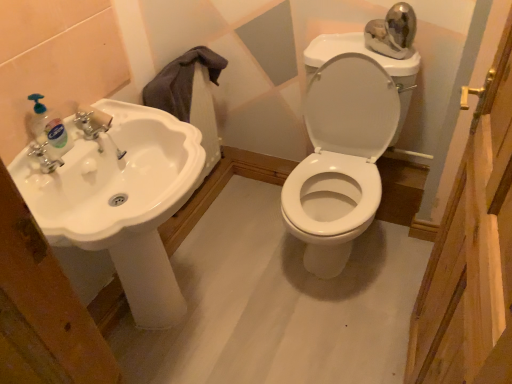
The image size is (512, 384). What are the coordinates of `white glossy sink at left` in the screenshot? It's located at (122, 201).

Describe the element at coordinates (340, 159) in the screenshot. I see `white glossy toilet at center` at that location.

Locate an element on the screen. Image resolution: width=512 pixels, height=384 pixels. white glossy sink at left is located at coordinates (122, 201).

Identify the location of soap dispenser lying on the left of white glossy toilet at center. The height and width of the screenshot is (384, 512). (49, 129).

Between white glossy toilet at center and translucent plastic soap dispenser at left, which one has smaller size?

translucent plastic soap dispenser at left.

What's the angular difference between white glossy toilet at center and translucent plastic soap dispenser at left's facing directions?

white glossy toilet at center and translucent plastic soap dispenser at left are facing 90 degrees away from each other.

Can we say white glossy toilet at center lies outside translucent plastic soap dispenser at left?

Yes, white glossy toilet at center is not within translucent plastic soap dispenser at left.

From the image's perspective, between white glossy sink at left and white glossy toilet at center, which one is located above?

From the image's view, white glossy toilet at center is above.

In terms of size, does white glossy sink at left appear bigger or smaller than white glossy toilet at center?

white glossy sink at left is smaller than white glossy toilet at center.

Would you say white glossy sink at left is to the left or to the right of white glossy toilet at center in the picture?

From the image, it's evident that white glossy sink at left is to the left of white glossy toilet at center.

Is white glossy sink at left spatially inside white glossy toilet at center, or outside of it?

white glossy sink at left is spatially situated outside white glossy toilet at center.

Is translucent plastic soap dispenser at left in front of or behind white glossy sink at left in the image?

Visually, translucent plastic soap dispenser at left is located behind white glossy sink at left.

Considering the positions of objects translucent plastic soap dispenser at left and white glossy sink at left in the image provided, who is more to the left, translucent plastic soap dispenser at left or white glossy sink at left?

From the viewer's perspective, translucent plastic soap dispenser at left appears more on the left side.

From a real-world perspective, is translucent plastic soap dispenser at left above or below white glossy sink at left?

translucent plastic soap dispenser at left is situated higher than white glossy sink at left in the real world.

Consider the image. Is translucent plastic soap dispenser at left outside of white glossy sink at left?

Yes.

Between point (49, 191) and point (37, 113), which one is positioned in front?

The point (49, 191) is closer to the camera.

Is white glossy sink at left wider or thinner than translucent plastic soap dispenser at left?

white glossy sink at left is wider than translucent plastic soap dispenser at left.

In the scene shown: Would you say white glossy sink at left is outside translucent plastic soap dispenser at left?

Yes, white glossy sink at left is located beyond the bounds of translucent plastic soap dispenser at left.

Which object is more forward, white glossy sink at left or translucent plastic soap dispenser at left?

white glossy sink at left is in front.

From a real-world perspective, is white glossy toilet at center positioned above or below white glossy sink at left?

white glossy toilet at center is below white glossy sink at left.

Is white glossy toilet at center facing towards white glossy sink at left?

No, white glossy toilet at center is not turned towards white glossy sink at left.

How much distance is there between white glossy toilet at center and white glossy sink at left?

24.91 inches.

Between white glossy toilet at center and white glossy sink at left, which one has smaller size?

white glossy sink at left is smaller.

Which is nearer, (53, 123) or (330, 209)?

The point (53, 123) is in front.

Is translucent plastic soap dispenser at left not close to white glossy toilet at center?

No.

Is translucent plastic soap dispenser at left located outside white glossy toilet at center?

Yes, translucent plastic soap dispenser at left is located beyond the bounds of white glossy toilet at center.

This screenshot has height=384, width=512. I want to click on toilet behind the translucent plastic soap dispenser at left, so click(x=340, y=159).

This screenshot has width=512, height=384. I want to click on toilet above the white glossy sink at left (from the image's perspective), so click(340, 159).

From the picture: Considering their positions, is white glossy toilet at center positioned closer to white glossy sink at left than translucent plastic soap dispenser at left?

translucent plastic soap dispenser at left lies closer to white glossy sink at left than the other object.

Based on their spatial positions, is translucent plastic soap dispenser at left or white glossy toilet at center further from white glossy sink at left?

white glossy toilet at center lies further to white glossy sink at left than the other object.

When comparing their distances from translucent plastic soap dispenser at left, does white glossy toilet at center or white glossy sink at left seem further?

Among the two, white glossy toilet at center is located further to translucent plastic soap dispenser at left.

Estimate the real-world distances between objects in this image. Which object is closer to white glossy toilet at center, white glossy sink at left or translucent plastic soap dispenser at left?

Based on the image, white glossy sink at left appears to be nearer to white glossy toilet at center.

Based on the photo, based on their spatial positions, is translucent plastic soap dispenser at left or white glossy sink at left further from white glossy toilet at center?

translucent plastic soap dispenser at left.

Estimate the real-world distances between objects in this image. Which object is further from translucent plastic soap dispenser at left, white glossy sink at left or white glossy toilet at center?

white glossy toilet at center is further to translucent plastic soap dispenser at left.

Image resolution: width=512 pixels, height=384 pixels. I want to click on sink between translucent plastic soap dispenser at left and white glossy toilet at center, so click(x=122, y=201).